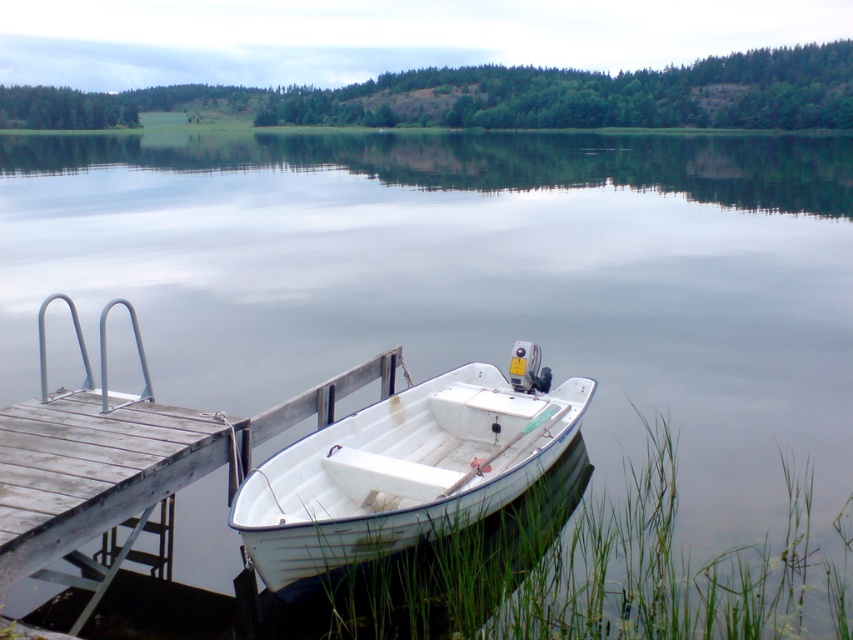
Question: Can you confirm if white matte boat at lower center is positioned to the left of wooden dock at lower left?

Choices:
 (A) no
 (B) yes

Answer: (A)

Question: Can you confirm if white matte boat at lower center is smaller than wooden dock at lower left?

Choices:
 (A) no
 (B) yes

Answer: (B)

Question: Among these objects, which one is nearest to the camera?

Choices:
 (A) wooden dock at lower left
 (B) white matte boat at lower center

Answer: (A)

Question: Is white matte boat at lower center wider than wooden dock at lower left?

Choices:
 (A) yes
 (B) no

Answer: (B)

Question: Which object is farther from the camera taking this photo?

Choices:
 (A) wooden dock at lower left
 (B) white matte boat at lower center

Answer: (B)